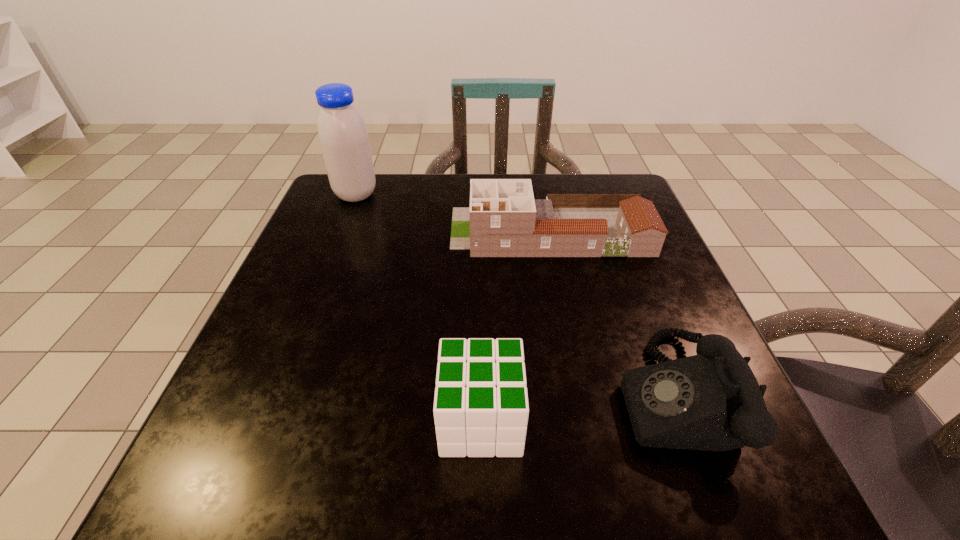
The width and height of the screenshot is (960, 540). In order to click on the tallest object in this screenshot , I will do click(x=343, y=136).

Identify the location of soya milk. (343, 136).

Where is `the second tallest object`? The width and height of the screenshot is (960, 540). the second tallest object is located at coordinates (503, 220).

I want to click on dollhouse, so click(x=503, y=220).

Find the location of a particular element. cube is located at coordinates (481, 408).

At what (x,y) coordinates should I click in order to perform the action: click on telephone. Please return your answer as a coordinate pair (x, y). This screenshot has height=540, width=960. Looking at the image, I should click on tap(712, 401).

This screenshot has height=540, width=960. What are the coordinates of `vacant space situated 0.220m on the front of the soya milk` in the screenshot? It's located at (328, 265).

In order to click on free location located 0.190m at the main entrance of the third nearest object in this screenshot , I will do `click(368, 232)`.

This screenshot has width=960, height=540. What are the coordinates of `free region located at the main entrance of the third nearest object` in the screenshot? It's located at (372, 232).

Image resolution: width=960 pixels, height=540 pixels. Identify the location of vacant space located at the main entrance of the third nearest object. (390, 232).